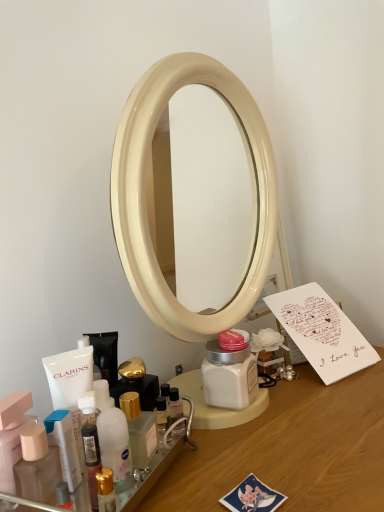
Question: Does point [6, 453] appear closer or farther from the camera than point [89, 501]?

Choices:
 (A) closer
 (B) farther

Answer: (B)

Question: Is matte pink container at lower left, marked as the 1th toiletry in a left-to-right arrangement, in front of or behind translucent plastic bottle at lower left, which appears as the first toiletry when viewed from the right, in the image?

Choices:
 (A) behind
 (B) front

Answer: (A)

Question: Which object is the farthest from the matte plastic bottle at lower left, which is counted as the second toiletry, starting from the right?

Choices:
 (A) white paper card at right
 (B) matte pink container at lower left, placed as the 3th toiletry when sorted from right to left
 (C) wooden desk at center
 (D) translucent plastic bottle at lower left, which appears as the first toiletry when viewed from the right

Answer: (A)

Question: Estimate the real-world distances between objects in this image. Which object is farther from the matte pink container at lower left, placed as the 3th toiletry when sorted from right to left?

Choices:
 (A) matte plastic bottle at lower left, which is the second toiletry from left to right
 (B) translucent plastic bottle at lower left, acting as the 3th toiletry starting from the left
 (C) wooden desk at center
 (D) white paper card at right

Answer: (D)